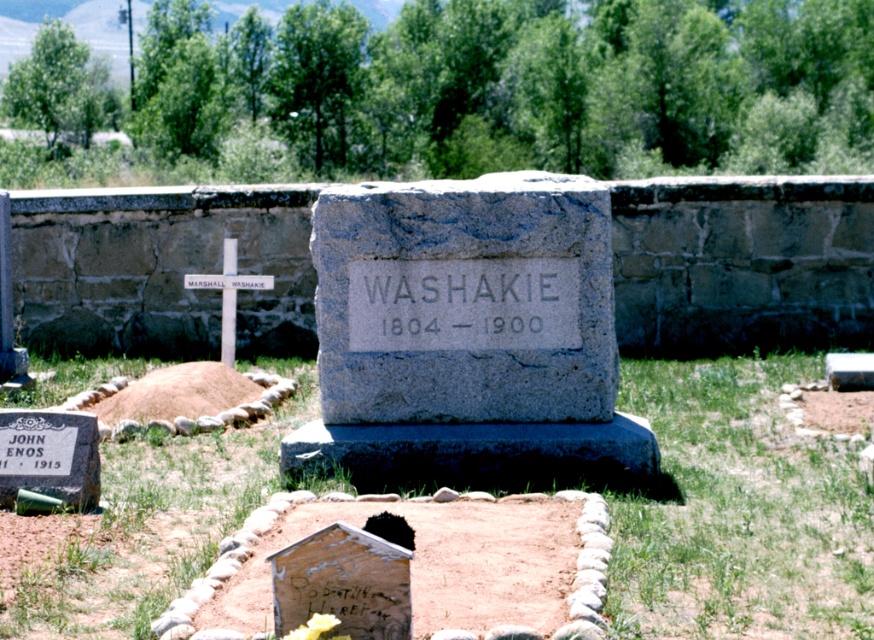
Question: Which point is closer to the camera taking this photo?

Choices:
 (A) click(417, 192)
 (B) click(229, 278)

Answer: (A)

Question: Does gray stone monument at center have a smaller size compared to white wood cross at center?

Choices:
 (A) no
 (B) yes

Answer: (A)

Question: Among these points, which one is farthest from the camera?

Choices:
 (A) (535, 371)
 (B) (189, 275)

Answer: (B)

Question: Is gray stone monument at center wider than white wood cross at center?

Choices:
 (A) yes
 (B) no

Answer: (A)

Question: Is gray stone monument at center positioned behind white wood cross at center?

Choices:
 (A) no
 (B) yes

Answer: (A)